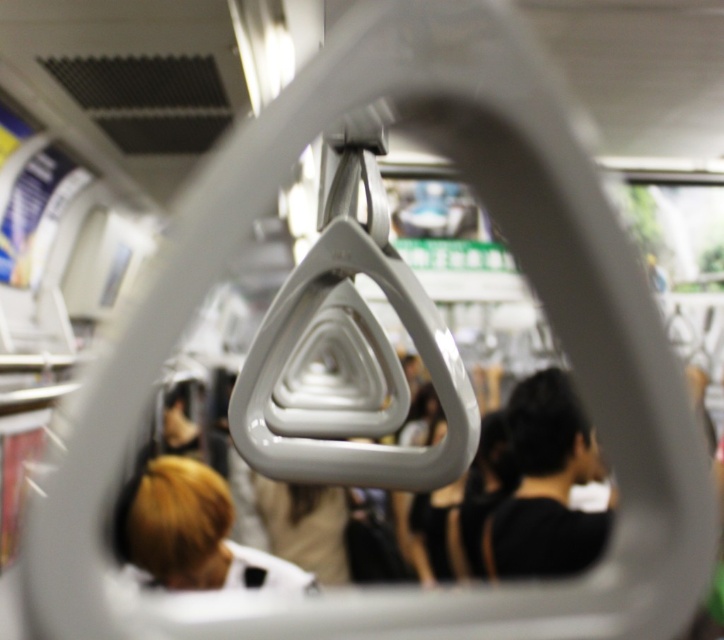
Question: Which point is farther to the camera?

Choices:
 (A) blonde hair at lower left
 (B) black matte hair at center

Answer: (B)

Question: Among these points, which one is nearest to the camera?

Choices:
 (A) (156, 528)
 (B) (550, 532)

Answer: (A)

Question: From the image, what is the correct spatial relationship of black matte hair at center in relation to blonde hair at lower left?

Choices:
 (A) left
 (B) right

Answer: (B)

Question: Does black matte hair at center appear over blonde hair at lower left?

Choices:
 (A) no
 (B) yes

Answer: (B)

Question: Can you confirm if black matte hair at center is positioned to the right of blonde hair at lower left?

Choices:
 (A) no
 (B) yes

Answer: (B)